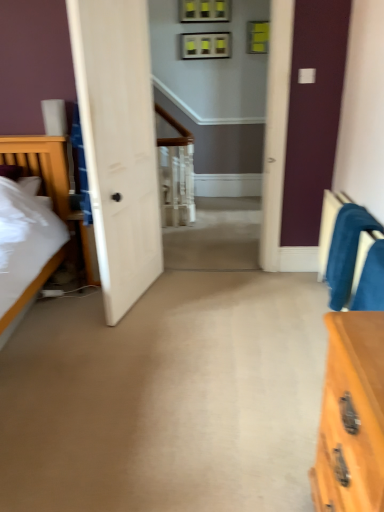
Measure the distance between point (371, 215) and camera.

2.14 meters.

What do you see at coordinates (346, 251) in the screenshot?
I see `velvet blue armchair at right, which ranks as the 1th armchair in back-to-front order` at bounding box center [346, 251].

This screenshot has height=512, width=384. What are the coordinates of `velvet blue armchair at right, which ranks as the 1th armchair in back-to-front order` in the screenshot? It's located at (346, 251).

What do you see at coordinates (371, 281) in the screenshot? I see `velvet blue armchair at right, arranged as the 2th armchair when viewed from the back` at bounding box center [371, 281].

This screenshot has width=384, height=512. What are the coordinates of `velvet blue armchair at right, arranged as the 2th armchair when viewed from the back` in the screenshot? It's located at (371, 281).

Find the location of `velvet blue armchair at right, which ranks as the 1th armchair in back-to-front order`. velvet blue armchair at right, which ranks as the 1th armchair in back-to-front order is located at coordinates (346, 251).

Is velvet blue armchair at right, arranged as the 2th armchair when viewed from the back, to the left of velvet blue armchair at right, which ranks as the 1th armchair in back-to-front order, from the viewer's perspective?

Indeed, velvet blue armchair at right, arranged as the 2th armchair when viewed from the back, is positioned on the left side of velvet blue armchair at right, which ranks as the 1th armchair in back-to-front order.

Which is behind, velvet blue armchair at right, arranged as the 2th armchair when viewed from the back, or velvet blue armchair at right, which ranks as the 1th armchair in back-to-front order?

Positioned behind is velvet blue armchair at right, which ranks as the 1th armchair in back-to-front order.

Is point (378, 271) closer to viewer compared to point (351, 226)?

Yes, point (378, 271) is in front of point (351, 226).

From the image's perspective, is velvet blue armchair at right, arranged as the 2th armchair when viewed from the back, below velvet blue armchair at right, the second armchair in the front-to-back sequence?

Yes, from the image's perspective, velvet blue armchair at right, arranged as the 2th armchair when viewed from the back, is beneath velvet blue armchair at right, the second armchair in the front-to-back sequence.

From a real-world perspective, is velvet blue armchair at right, the 1th armchair viewed from the front, on velvet blue armchair at right, which ranks as the 1th armchair in back-to-front order?

Correct, in the physical world, velvet blue armchair at right, the 1th armchair viewed from the front, is higher than velvet blue armchair at right, which ranks as the 1th armchair in back-to-front order.

Does velvet blue armchair at right, the 1th armchair viewed from the front, have a greater width compared to velvet blue armchair at right, which ranks as the 1th armchair in back-to-front order?

Yes, velvet blue armchair at right, the 1th armchair viewed from the front, is wider than velvet blue armchair at right, which ranks as the 1th armchair in back-to-front order.

Can you confirm if velvet blue armchair at right, the 1th armchair viewed from the front, is taller than velvet blue armchair at right, which ranks as the 1th armchair in back-to-front order?

Incorrect, the height of velvet blue armchair at right, the 1th armchair viewed from the front, is not larger of that of velvet blue armchair at right, which ranks as the 1th armchair in back-to-front order.

Considering the sizes of objects velvet blue armchair at right, the 1th armchair viewed from the front, and velvet blue armchair at right, the second armchair in the front-to-back sequence, in the image provided, who is bigger, velvet blue armchair at right, the 1th armchair viewed from the front, or velvet blue armchair at right, the second armchair in the front-to-back sequence,?

Bigger between the two is velvet blue armchair at right, the second armchair in the front-to-back sequence.

Looking at this image, is velvet blue armchair at right, the 1th armchair viewed from the front, outside of velvet blue armchair at right, which ranks as the 1th armchair in back-to-front order?

That's correct, velvet blue armchair at right, the 1th armchair viewed from the front, is outside of velvet blue armchair at right, which ranks as the 1th armchair in back-to-front order.

Are velvet blue armchair at right, the 1th armchair viewed from the front, and velvet blue armchair at right, the second armchair in the front-to-back sequence, beside each other?

No, velvet blue armchair at right, the 1th armchair viewed from the front, is not making contact with velvet blue armchair at right, the second armchair in the front-to-back sequence.

Is velvet blue armchair at right, the 1th armchair viewed from the front, oriented away from velvet blue armchair at right, which ranks as the 1th armchair in back-to-front order?

No, velvet blue armchair at right, which ranks as the 1th armchair in back-to-front order, is not at the back of velvet blue armchair at right, the 1th armchair viewed from the front.

Can you tell me how much velvet blue armchair at right, the 1th armchair viewed from the front, and velvet blue armchair at right, which ranks as the 1th armchair in back-to-front order, differ in facing direction?

0.00209 degrees separate the facing orientations of velvet blue armchair at right, the 1th armchair viewed from the front, and velvet blue armchair at right, which ranks as the 1th armchair in back-to-front order.

Where is `armchair lying behind the velvet blue armchair at right, arranged as the 2th armchair when viewed from the back`? The height and width of the screenshot is (512, 384). armchair lying behind the velvet blue armchair at right, arranged as the 2th armchair when viewed from the back is located at coordinates (346, 251).

Which object is positioned more to the left, velvet blue armchair at right, the second armchair in the front-to-back sequence, or velvet blue armchair at right, the 1th armchair viewed from the front?

velvet blue armchair at right, the 1th armchair viewed from the front.

Between velvet blue armchair at right, the second armchair in the front-to-back sequence, and velvet blue armchair at right, the 1th armchair viewed from the front, which one is positioned behind?

velvet blue armchair at right, the second armchair in the front-to-back sequence, is behind.

Which is closer to the camera, (351, 274) or (378, 305)?

Point (351, 274) is positioned farther from the camera compared to point (378, 305).

From the image's perspective, between velvet blue armchair at right, which ranks as the 1th armchair in back-to-front order, and velvet blue armchair at right, the 1th armchair viewed from the front, who is located below?

velvet blue armchair at right, the 1th armchair viewed from the front, is shown below in the image.

From a real-world perspective, between velvet blue armchair at right, which ranks as the 1th armchair in back-to-front order, and velvet blue armchair at right, arranged as the 2th armchair when viewed from the back, who is vertically higher?

velvet blue armchair at right, arranged as the 2th armchair when viewed from the back, from a real-world perspective.

Between velvet blue armchair at right, the second armchair in the front-to-back sequence, and velvet blue armchair at right, arranged as the 2th armchair when viewed from the back, which one has larger width?

With larger width is velvet blue armchair at right, arranged as the 2th armchair when viewed from the back.

Who is taller, velvet blue armchair at right, the second armchair in the front-to-back sequence, or velvet blue armchair at right, the 1th armchair viewed from the front?

velvet blue armchair at right, the second armchair in the front-to-back sequence.

Between velvet blue armchair at right, which ranks as the 1th armchair in back-to-front order, and velvet blue armchair at right, the 1th armchair viewed from the front, which one has smaller size?

velvet blue armchair at right, the 1th armchair viewed from the front.

Is velvet blue armchair at right, arranged as the 2th armchair when viewed from the back, located within velvet blue armchair at right, the second armchair in the front-to-back sequence?

No, velvet blue armchair at right, arranged as the 2th armchair when viewed from the back, is not a part of velvet blue armchair at right, the second armchair in the front-to-back sequence.

Is velvet blue armchair at right, which ranks as the 1th armchair in back-to-front order, positioned far away from velvet blue armchair at right, the 1th armchair viewed from the front?

They are positioned close to each other.

Could you tell me if velvet blue armchair at right, the second armchair in the front-to-back sequence, is turned towards velvet blue armchair at right, arranged as the 2th armchair when viewed from the back?

No, velvet blue armchair at right, the second armchair in the front-to-back sequence, is not aimed at velvet blue armchair at right, arranged as the 2th armchair when viewed from the back.

Can you tell me how much velvet blue armchair at right, the second armchair in the front-to-back sequence, and velvet blue armchair at right, the 1th armchair viewed from the front, differ in facing direction?

velvet blue armchair at right, the second armchair in the front-to-back sequence, and velvet blue armchair at right, the 1th armchair viewed from the front, are facing 0.00209 degrees away from each other.

How far apart are velvet blue armchair at right, which ranks as the 1th armchair in back-to-front order, and velvet blue armchair at right, arranged as the 2th armchair when viewed from the back?

velvet blue armchair at right, which ranks as the 1th armchair in back-to-front order, and velvet blue armchair at right, arranged as the 2th armchair when viewed from the back, are 8.63 inches apart from each other.

The width and height of the screenshot is (384, 512). I want to click on armchair directly beneath the velvet blue armchair at right, the 1th armchair viewed from the front (from a real-world perspective), so click(x=346, y=251).

Locate an element on the screen. armchair below the velvet blue armchair at right, the 1th armchair viewed from the front (from a real-world perspective) is located at coordinates (346, 251).

Identify the location of armchair that appears on the left of velvet blue armchair at right, the second armchair in the front-to-back sequence. Image resolution: width=384 pixels, height=512 pixels. (371, 281).